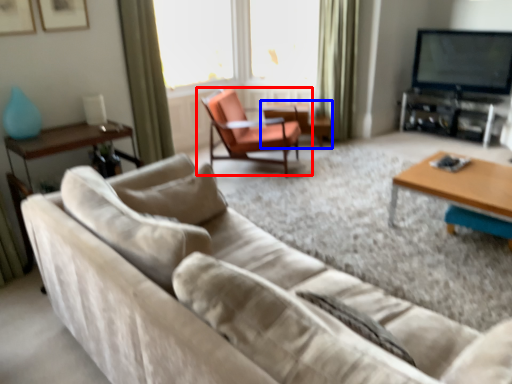
Question: Which of the following is the farthest to the observer, chair (highlighted by a red box) or side table (highlighted by a blue box)?

Choices:
 (A) chair
 (B) side table

Answer: (B)